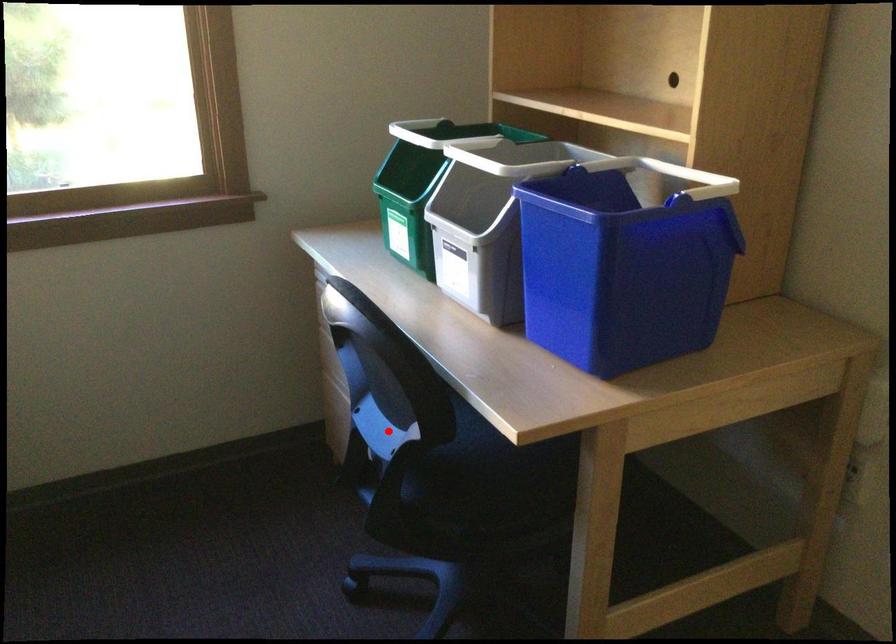
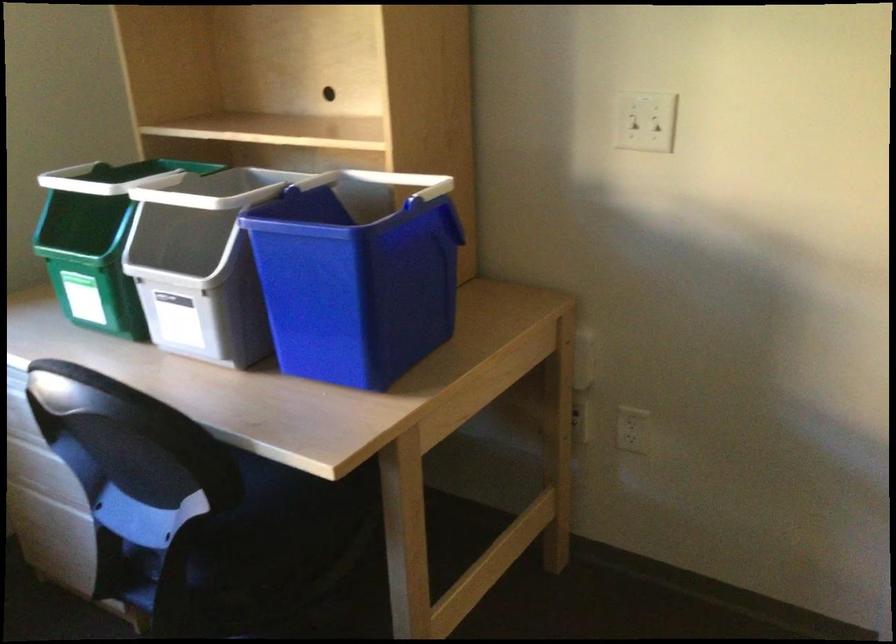
Find the pixel in the second image that matches the highlighted location in the first image.

(151, 518)